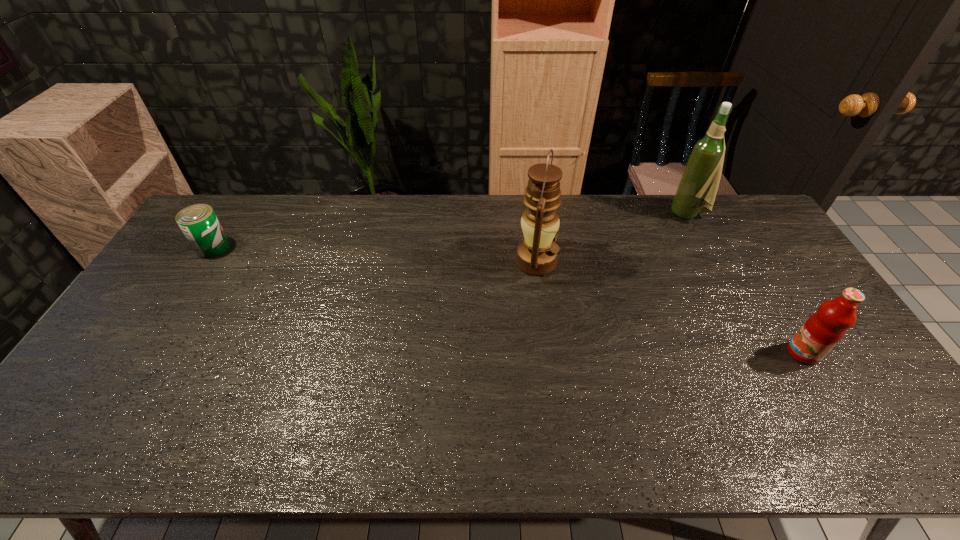
Image resolution: width=960 pixels, height=540 pixels. I want to click on free space located 0.340m on the right of the oil lamp, so pos(662,261).

Locate an element on the screen. free space located 0.260m on the front label of the nearest object is located at coordinates (691, 354).

You are a GUI agent. You are given a task and a screenshot of the screen. Output one action in this format:
    pyautogui.click(x=<x>, y=<y>)
    Task: Click on the vacant space located on the front label of the nearest object
    The image size is (960, 540).
    Given the screenshot: What is the action you would take?
    pyautogui.click(x=739, y=354)

Where is `vacant position located 0.050m on the front label of the nearest object`? Image resolution: width=960 pixels, height=540 pixels. vacant position located 0.050m on the front label of the nearest object is located at coordinates (769, 354).

You are a GUI agent. You are given a task and a screenshot of the screen. Output one action in this format:
    pyautogui.click(x=<x>, y=<y>)
    Task: Click on the blank space located on the front of the shortest object
    This screenshot has height=540, width=960.
    Given the screenshot: What is the action you would take?
    pyautogui.click(x=158, y=335)

The image size is (960, 540). Identify the location of wine bottle that is at the far edge. (700, 180).

Locate an element on the screen. The width and height of the screenshot is (960, 540). can that is at the far edge is located at coordinates (198, 222).

I want to click on object located at the left edge, so 198,222.

Where is `object that is at the right edge`? object that is at the right edge is located at coordinates (824, 329).

Locate an element on the screen. object that is positioned at the far left corner is located at coordinates (198, 222).